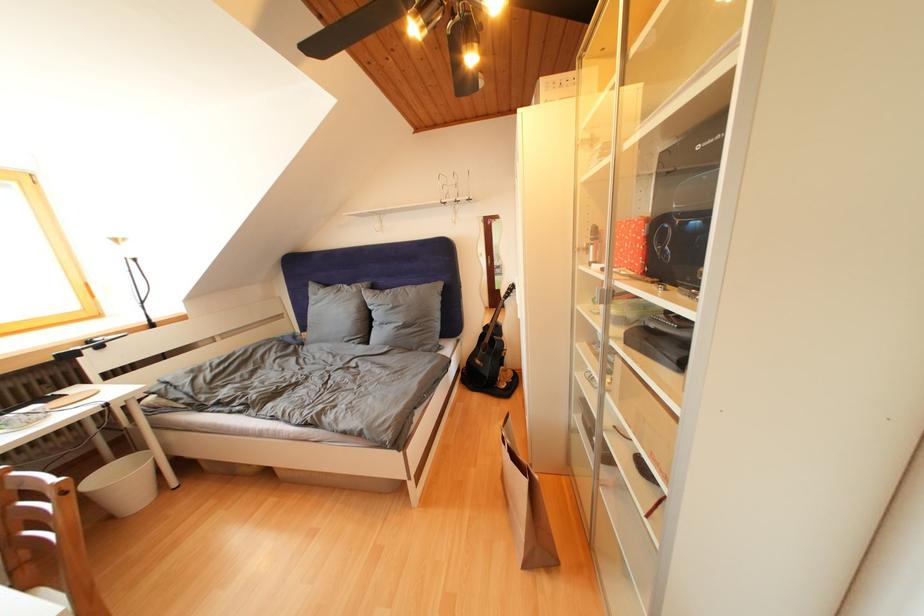
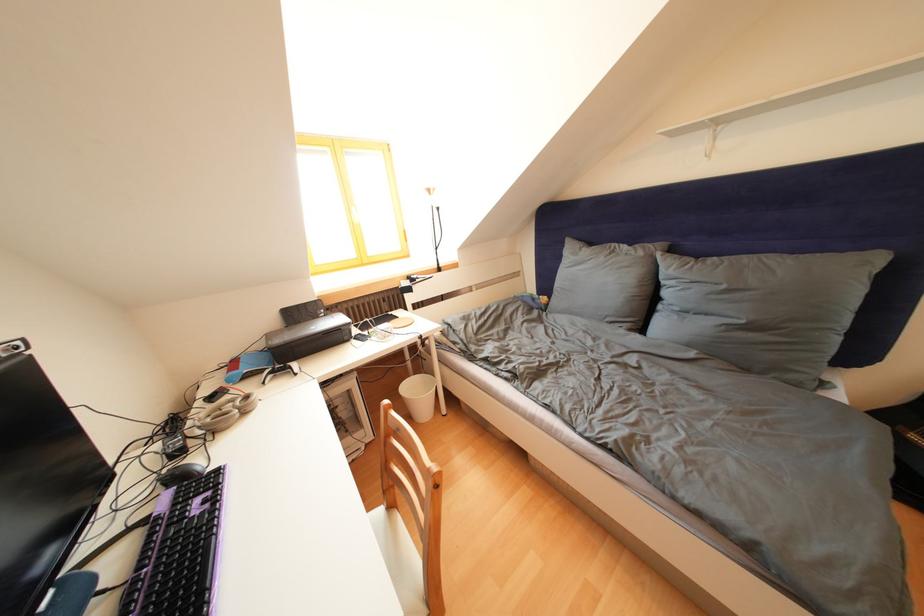
In the second image, find the point that corresponds to (362,294) in the first image.

(649, 259)